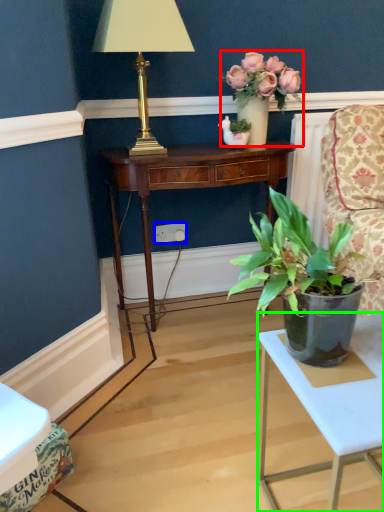
Question: Which object is the farthest from houseplant (highlighted by a red box)? Choose among these: power outlet (highlighted by a blue box) or table (highlighted by a green box).

Choices:
 (A) power outlet
 (B) table

Answer: (B)